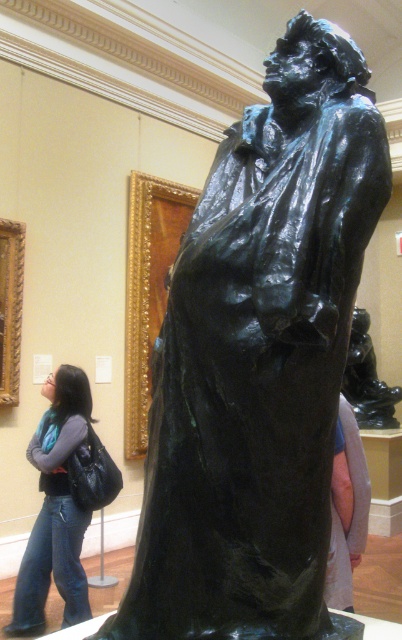
You are an art student who just entered the gallery and noticed the denim jeans at lower left and the shiny bronze statue at center. Which object is positioned lower in the image?

The denim jeans at lower left is located below the shiny bronze statue at center, so the denim jeans at lower left is positioned lower in the image.